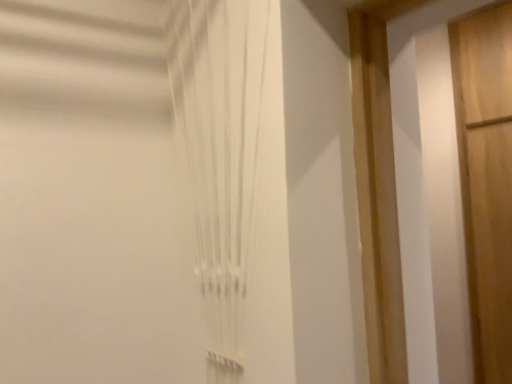
Describe the element at coordinates (486, 179) in the screenshot. Image resolution: width=512 pixels, height=384 pixels. I see `light brown wooden door at right` at that location.

Where is `light brown wooden door at right`? The height and width of the screenshot is (384, 512). light brown wooden door at right is located at coordinates (486, 179).

Image resolution: width=512 pixels, height=384 pixels. I want to click on light brown wooden door at right, so click(x=486, y=179).